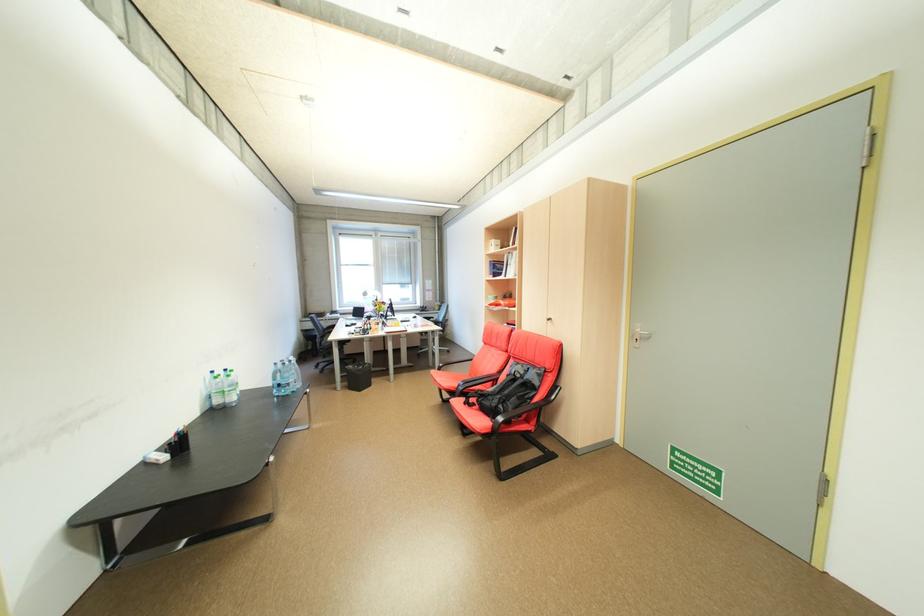
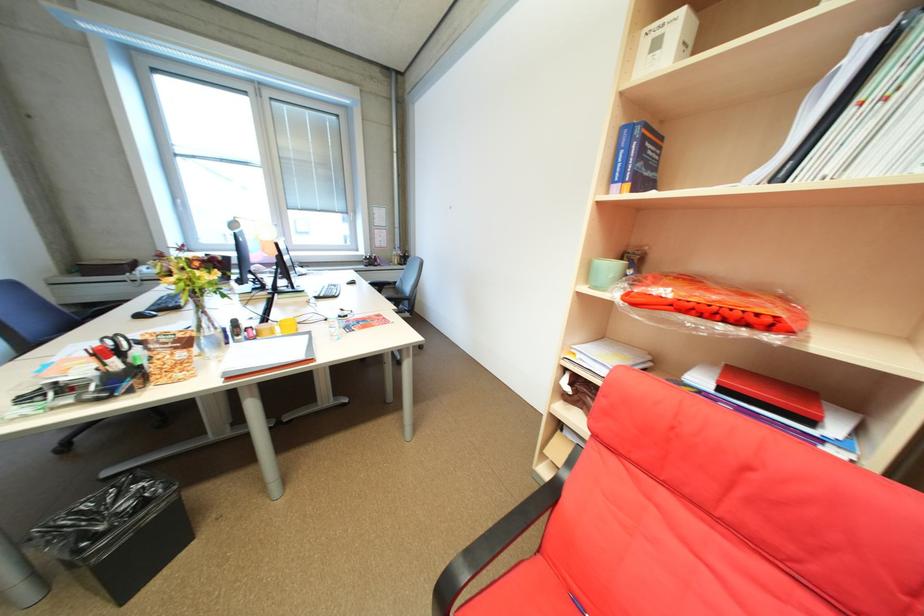
Question: What movement of the cameraman would produce the second image?

Choices:
 (A) Left
 (B) Right
 (C) Forward
 (D) Backward

Answer: (C)